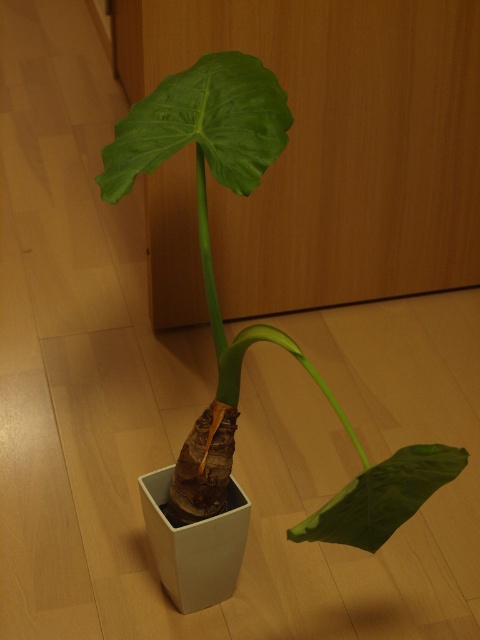
Question: Among these objects, which one is nearest to the camera?

Choices:
 (A) green matte leaf at lower right
 (B) green matte leaf at center

Answer: (A)

Question: Is the position of green matte leaf at center less distant than that of green matte leaf at lower right?

Choices:
 (A) no
 (B) yes

Answer: (A)

Question: Observing the image, what is the correct spatial positioning of green matte leaf at upper center in reference to green matte leaf at lower right?

Choices:
 (A) left
 (B) right

Answer: (A)

Question: Is green matte leaf at upper center thinner than green matte leaf at lower right?

Choices:
 (A) yes
 (B) no

Answer: (B)

Question: Which object is positioned farthest from the green matte leaf at lower right?

Choices:
 (A) green matte leaf at center
 (B) green matte leaf at upper center

Answer: (B)

Question: Which point is farther from the camera taking this photo?

Choices:
 (A) (362, 480)
 (B) (273, 84)

Answer: (B)